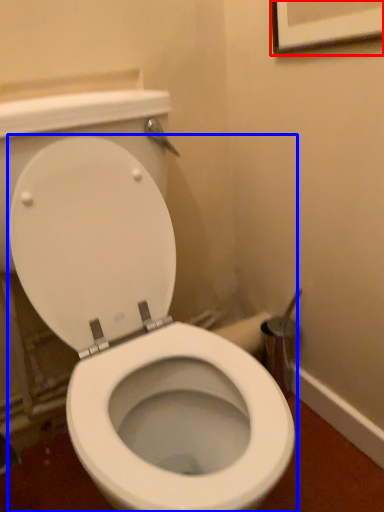
Question: Which of the following is the farthest to the observer, picture frame (highlighted by a red box) or toilet (highlighted by a blue box)?

Choices:
 (A) picture frame
 (B) toilet

Answer: (A)